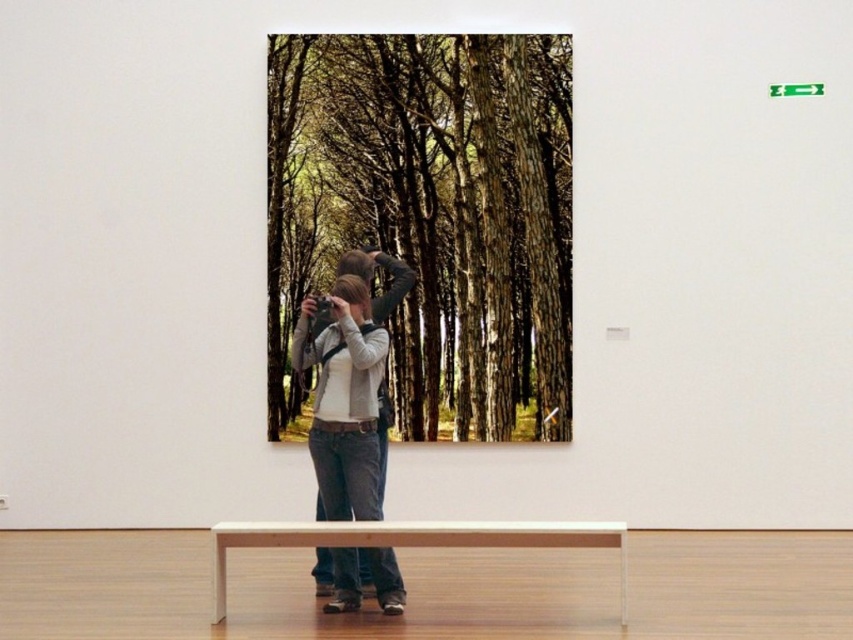
You are standing in the art gallery and want to sit down on the light brown wooden bench at lower center. Based on its position, where should you walk to find it?

The light brown wooden bench at lower center is located at coordinates approximately 0.847 on the x axis and 0.487 on the y axis, so you should walk towards the lower central area of the gallery to find it.

Based on the photo, you are an interior designer planning to place a new sofa in this art gallery. The sofa you have in mind is the same size as the denim jeans at center. Will the sofa fit in the space where the green textured forest at center currently hangs?

The green textured forest at center is larger in size than the denim jeans at center. Since the sofa is the same size as the denim jeans at center, it would not fit in the space where the green textured forest at center is currently hanging because the space is designed for a larger artwork.

Looking at this image, you are an interior designer planning to place a new sculpture between the green textured forest at center and the light brown wooden bench at lower center. Based on their sizes, which object should the sculpture be closer to?

The sculpture should be closer to the light brown wooden bench at lower center because the green textured forest at center is smaller than the light brown wooden bench at lower center, so the bench is larger and might provide a better scale for the sculpture.